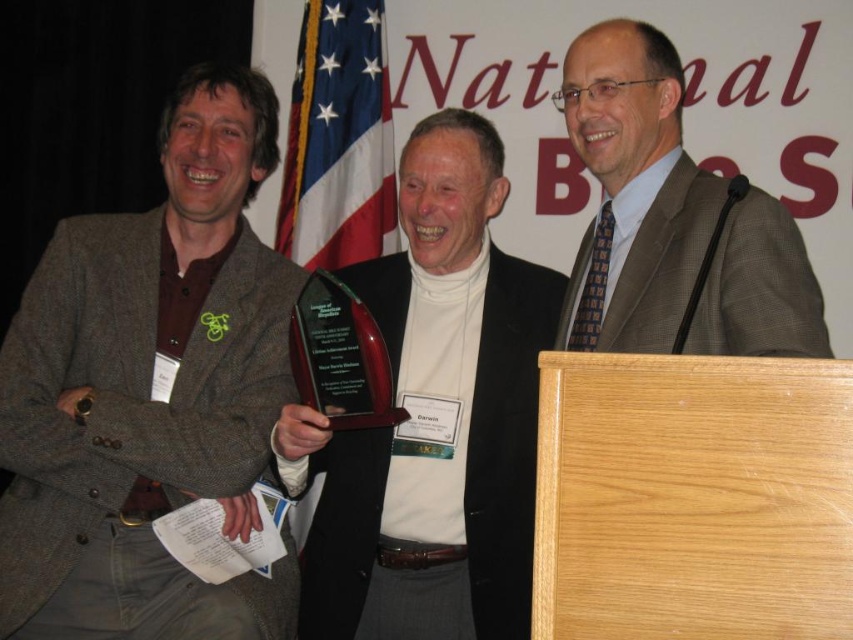
Is shiny dark wood award at center closer to the viewer compared to plaid wool suit at center?

That is False.

Is shiny dark wood award at center to the right of plaid wool suit at center from the viewer's perspective?

Incorrect, shiny dark wood award at center is not on the right side of plaid wool suit at center.

Measure the distance between point (473,195) and camera.

Point (473,195) and camera are 6.22 feet apart from each other.

Find the location of a particular element. This screenshot has width=853, height=640. shiny dark wood award at center is located at coordinates (433, 419).

Describe the element at coordinates (149, 390) in the screenshot. The image size is (853, 640). I see `matte brown blazer at center` at that location.

Who is positioned more to the right, matte brown blazer at center or plaid wool suit at center?

Positioned to the right is plaid wool suit at center.

Does point (230, 396) come closer to viewer compared to point (807, 336)?

No, (230, 396) is behind (807, 336).

Locate an element on the screen. Image resolution: width=853 pixels, height=640 pixels. matte brown blazer at center is located at coordinates (149, 390).

Is matte brown blazer at center positioned behind shiny dark wood award at center?

Yes.

Does matte brown blazer at center have a larger size compared to shiny dark wood award at center?

Indeed, matte brown blazer at center has a larger size compared to shiny dark wood award at center.

Who is more distant from viewer, (x=84, y=515) or (x=450, y=609)?

The point (x=450, y=609) is more distant.

Find the location of a particular element. Image resolution: width=853 pixels, height=640 pixels. matte brown blazer at center is located at coordinates (149, 390).